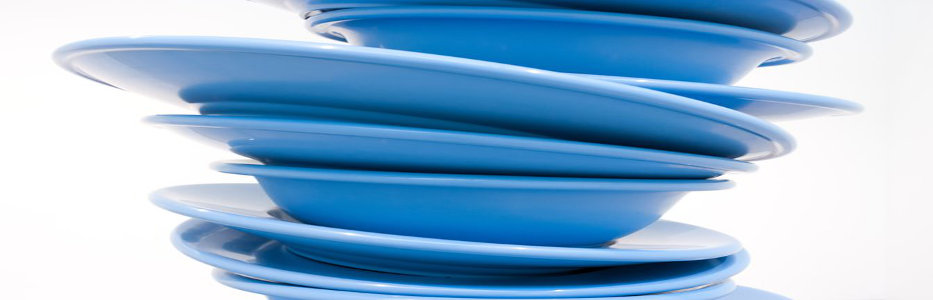
Find the location of a particular element. Image resolution: width=933 pixels, height=300 pixels. stacked blue plates and bowls is located at coordinates (819, 15), (756, 45), (785, 99), (725, 124), (324, 140), (329, 186), (272, 215), (221, 257), (248, 283).